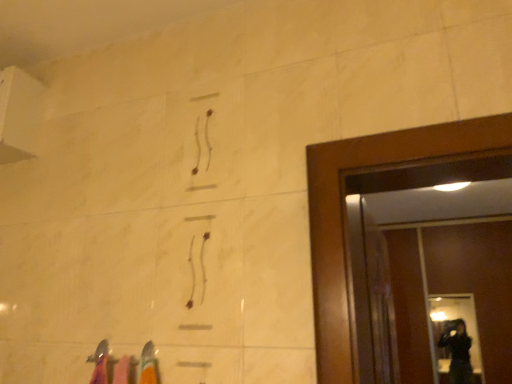
Question: From their relative heights in the image, would you say transparent glass door at right is taller or shorter than transparent glass screen door at right?

Choices:
 (A) short
 (B) tall

Answer: (A)

Question: Relative to transparent glass screen door at right, is transparent glass door at right in front or behind?

Choices:
 (A) front
 (B) behind

Answer: (B)

Question: Is point (478, 375) positioned closer to the camera than point (396, 327)?

Choices:
 (A) closer
 (B) farther

Answer: (A)

Question: From their relative heights in the image, would you say transparent glass screen door at right is taller or shorter than transparent glass door at right?

Choices:
 (A) short
 (B) tall

Answer: (B)

Question: In the image, is transparent glass screen door at right positioned in front of or behind transparent glass door at right?

Choices:
 (A) front
 (B) behind

Answer: (A)

Question: Is transparent glass screen door at right to the left or to the right of transparent glass door at right in the image?

Choices:
 (A) right
 (B) left

Answer: (A)

Question: Considering the positions of transparent glass screen door at right and transparent glass door at right in the image, is transparent glass screen door at right wider or thinner than transparent glass door at right?

Choices:
 (A) thin
 (B) wide

Answer: (B)